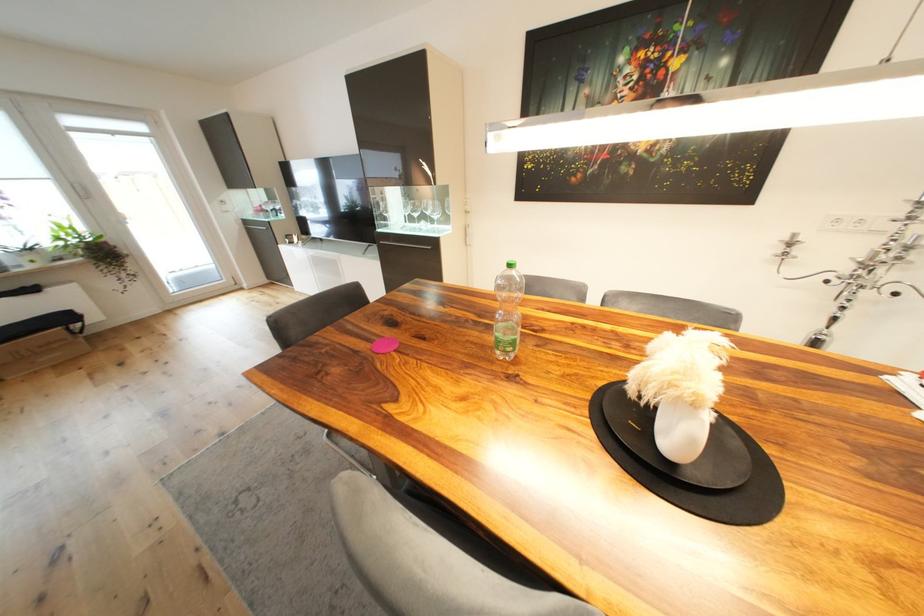
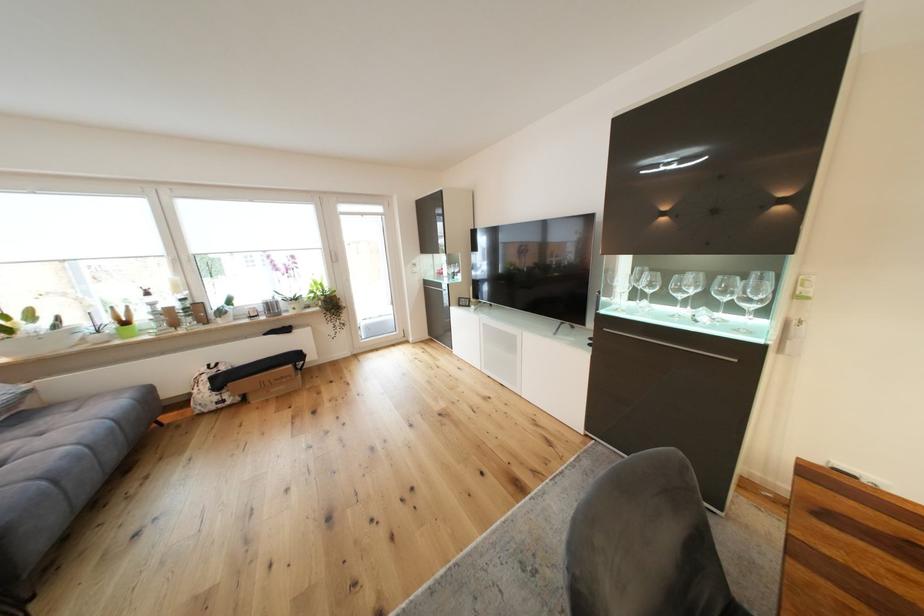
What movement of the cameraman would produce the second image?

The movement direction of the cameraman is left, forward.